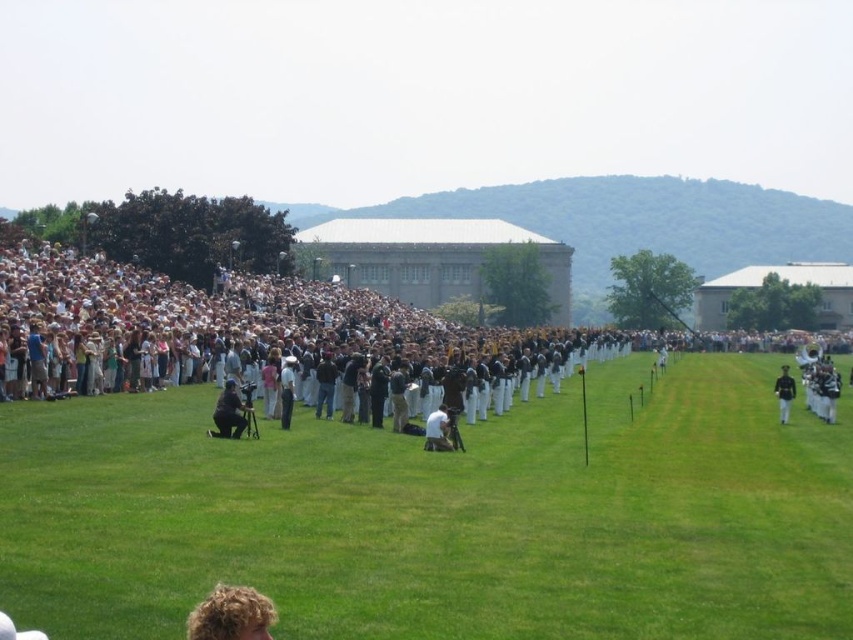
You are a photographer at the event and need to capture a clear shot of the dark blue uniform at center. The matte black camera at lower center is in your way. Can you adjust your position to take the photo without moving the camera?

The matte black camera at lower center is shorter than the dark blue uniform at center, so you can adjust your position to look over the matte black camera at lower center and still capture the dark blue uniform at center in your shot.

You are a photographer trying to capture a clear shot of the curly blonde hair at lower left. The photographer is standing at the point marked by the coordinates point (231, 614). Where should you position yourself to avoid blocking the view of the crowd on the left side?

The point (231, 614) marks the location of the curly blonde hair at lower left. To avoid blocking the crowd on the left side, position yourself behind this point so that you are facing towards the crowd, ensuring your body doesn t obstruct their view.

You are a photographer at the event and need to position your matte black camera at lower center to capture the dark blue uniform at center clearly. Since the camera is positioned lower, will it be able to see the uniform without obstruction?

The matte black camera at lower center is thinner than the dark blue uniform at center, so it might be partially obstructed depending on their exact positions. However, since the camera is positioned lower, it can still capture the uniform as long as there isn